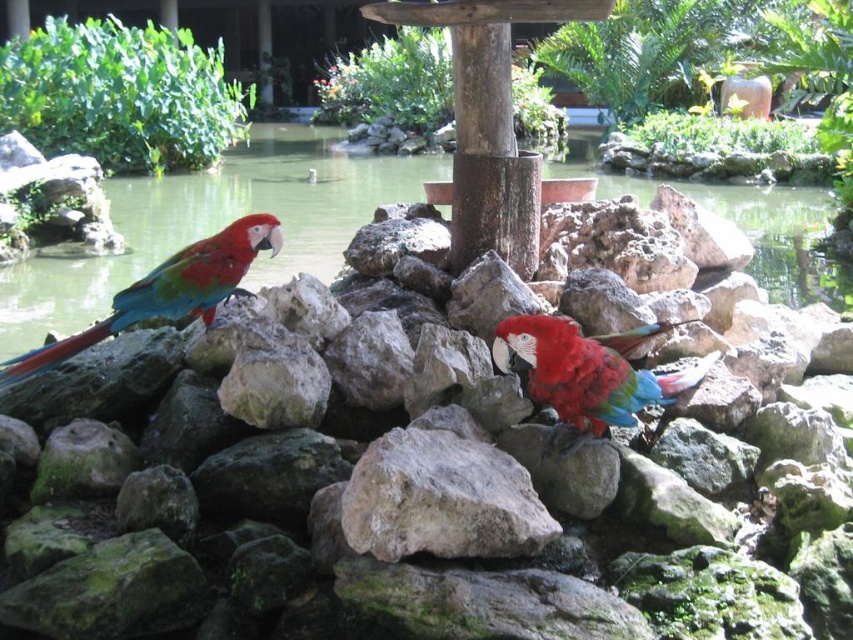
You are a drone operator tasked with capturing aerial footage of the scene. Your drone has a maximum flight range of 4 meters. If you are currently positioned above the greenish water at center, can you safely fly your drone to the shiny multicolored parrot at center without exceeding the flight range?

The distance between the greenish water at center and the shiny multicolored parrot at center is 4.35 meters, which exceeds the drone operator maximum flight range of 4 meters. Therefore, the drone cannot safely reach the shiny multicolored parrot at center without exceeding its range.

You are standing in the scene and want to place a small flag at each of the two points, point (457,460) and point (548,371). Which point will have its flag closer to your eyes?

Point (457,460) is closer to the camera than point (548,371), so the flag placed at point (457,460) will be closer to your eyes.

You are a photographer trying to capture a photo of the shiny multicolored parrot at center and the greenish water at center. From your current position, which object is located to the left of the other?

The greenish water at center is positioned on the left side of the shiny multicolored parrot at center.